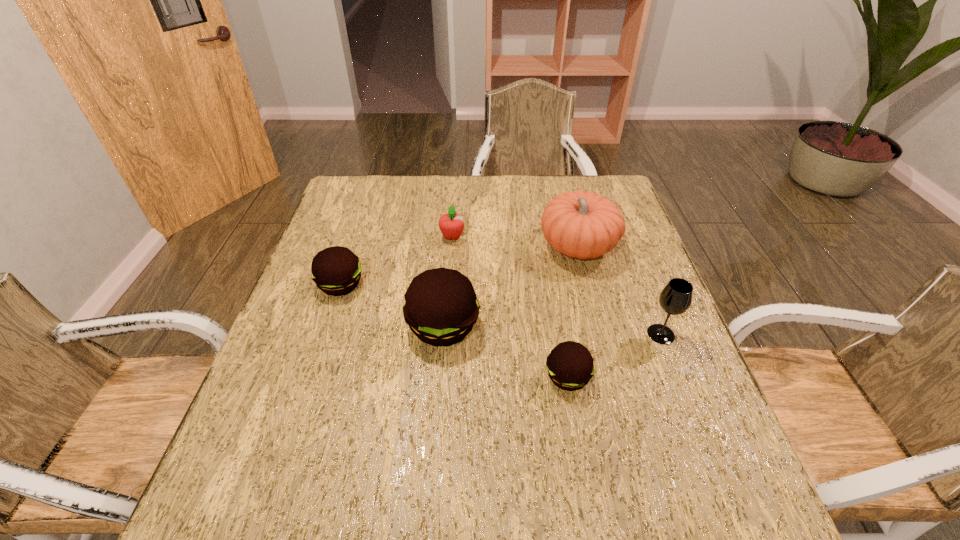
The height and width of the screenshot is (540, 960). I want to click on the second shortest patty, so click(x=336, y=270).

Locate an element on the screen. Image resolution: width=960 pixels, height=540 pixels. the leftmost patty is located at coordinates (336, 270).

Where is `the tallest patty`? the tallest patty is located at coordinates (441, 307).

Where is `the shortest patty`? The height and width of the screenshot is (540, 960). the shortest patty is located at coordinates (570, 366).

Locate an element on the screen. the rightmost patty is located at coordinates [x=570, y=366].

Where is `pumpkin`? This screenshot has width=960, height=540. pumpkin is located at coordinates (583, 225).

What are the coordinates of `apple` in the screenshot? It's located at (451, 224).

This screenshot has width=960, height=540. Find the location of `wineglass`. wineglass is located at coordinates (676, 297).

You are a GUI agent. You are given a task and a screenshot of the screen. Output one action in this format:
    pyautogui.click(x=<x>, y=<y>)
    Task: Click on the vacant space located 0.080m on the back of the second tallest patty
    
    Given the screenshot: What is the action you would take?
    pyautogui.click(x=352, y=249)

You are a GUI agent. You are given a task and a screenshot of the screen. Output one action in this format:
    pyautogui.click(x=<x>, y=<y>)
    Task: Click on the free space located 0.330m on the back of the tallest patty
    The width and height of the screenshot is (960, 540).
    Given the screenshot: What is the action you would take?
    pyautogui.click(x=451, y=221)